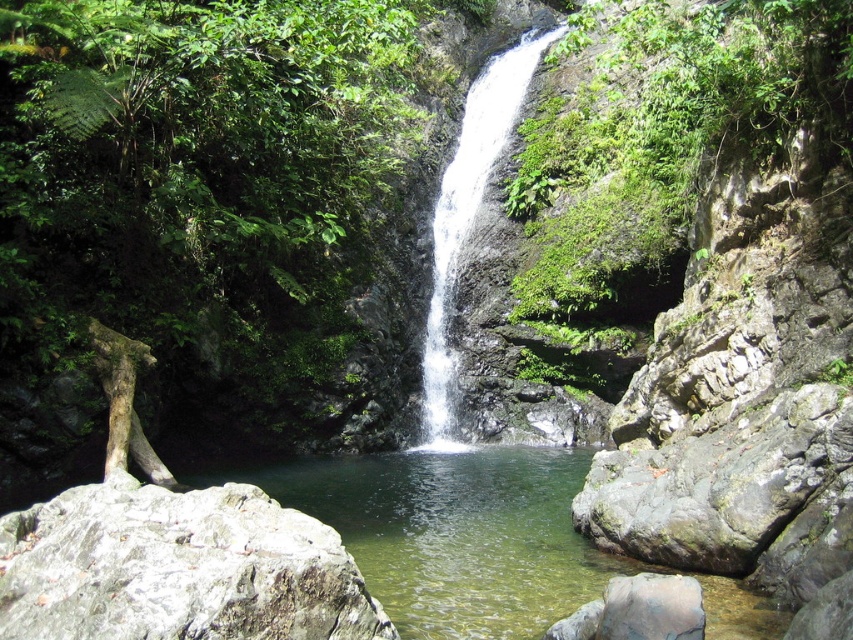
How much distance is there between clear water at center and gray rough rock at lower left?

The distance of clear water at center from gray rough rock at lower left is 11.89 meters.

Is clear water at center closer to the viewer compared to gray rough rock at lower left?

No, clear water at center is behind gray rough rock at lower left.

Find the location of a particular element. The height and width of the screenshot is (640, 853). clear water at center is located at coordinates tap(451, 532).

Find the location of a particular element. The height and width of the screenshot is (640, 853). clear water at center is located at coordinates (451, 532).

Between clear water at center and white smooth waterfall at center, which one appears on the right side from the viewer's perspective?

white smooth waterfall at center is more to the right.

Who is higher up, clear water at center or white smooth waterfall at center?

white smooth waterfall at center is above.

Who is more distant from viewer, (595, 554) or (457, 196)?

The point (457, 196) is more distant.

Where is `clear water at center`? This screenshot has width=853, height=640. clear water at center is located at coordinates (x=451, y=532).

Does gray rough rock at lower left have a greater height compared to gray rough rock at right?

In fact, gray rough rock at lower left may be shorter than gray rough rock at right.

Between gray rough rock at lower left and gray rough rock at right, which one has more height?

Standing taller between the two is gray rough rock at right.

Which is behind, point (277, 589) or point (601, 467)?

The point (601, 467) is more distant.

This screenshot has width=853, height=640. What are the coordinates of `gray rough rock at lower left` in the screenshot? It's located at (177, 568).